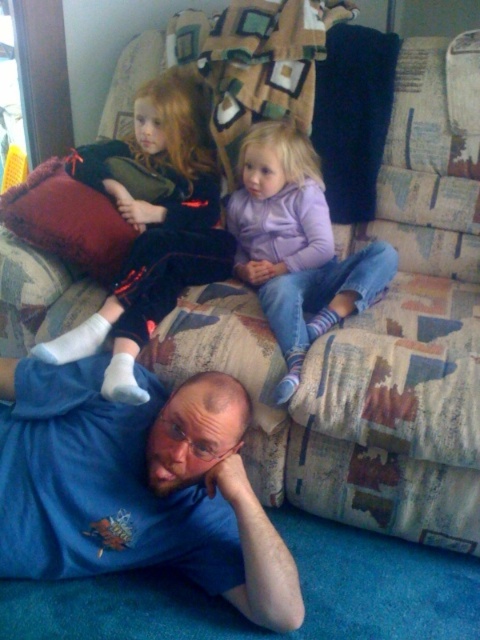
Question: Does purple fleece jacket at center have a larger size compared to velvet red pillow at upper left?

Choices:
 (A) no
 (B) yes

Answer: (B)

Question: Is matte black dress at upper left smaller than purple fleece jacket at center?

Choices:
 (A) yes
 (B) no

Answer: (B)

Question: Which of these objects is positioned farthest from the blue t-shirt at lower left?

Choices:
 (A) matte black dress at upper left
 (B) velvet red pillow at upper left

Answer: (B)

Question: Based on their relative distances, which object is farther from the velvet red pillow at upper left?

Choices:
 (A) blue t-shirt at lower left
 (B) matte black dress at upper left

Answer: (A)

Question: Which object is closer to the camera taking this photo?

Choices:
 (A) purple fleece jacket at center
 (B) velvet red pillow at upper left

Answer: (A)

Question: Can you confirm if matte black dress at upper left is positioned to the left of velvet red pillow at upper left?

Choices:
 (A) no
 (B) yes

Answer: (A)